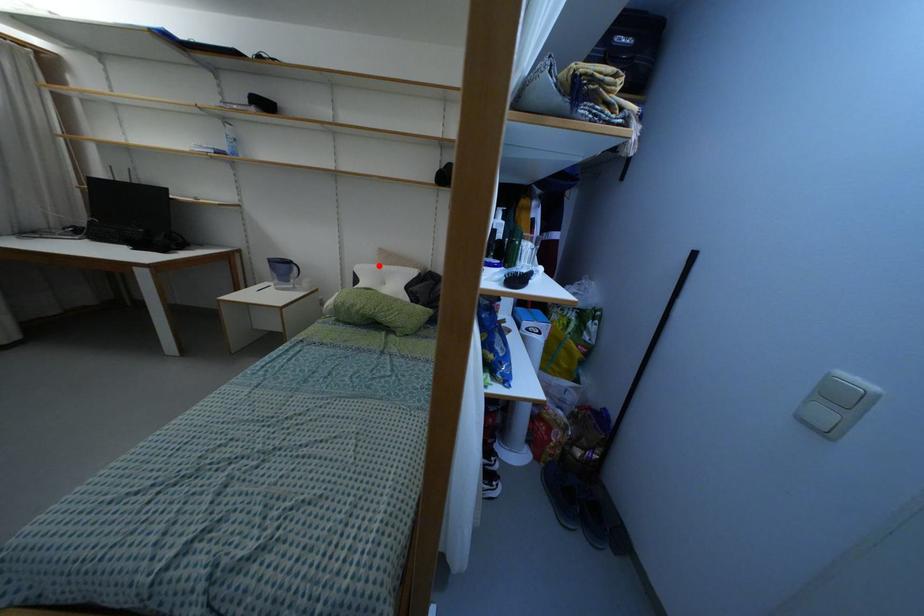
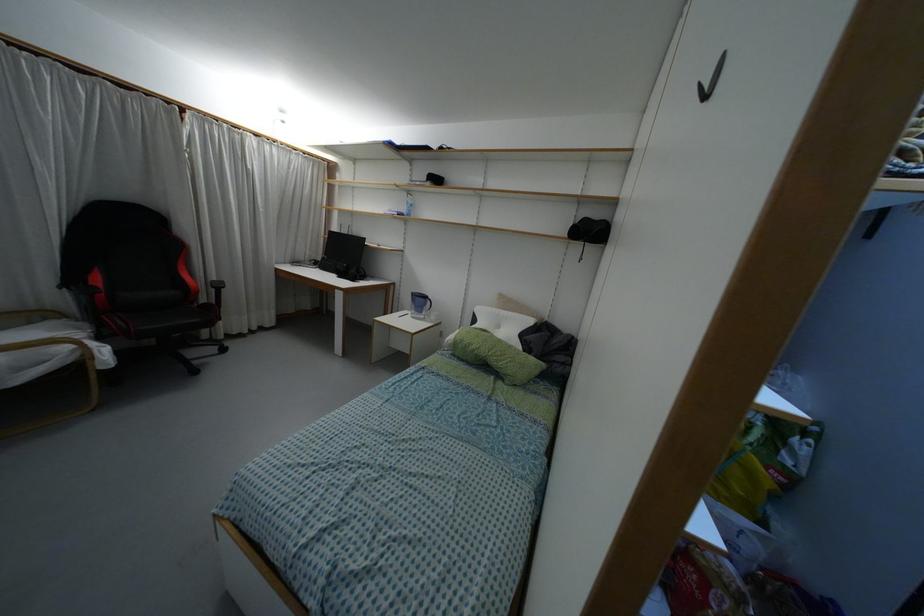
In the second image, find the point that corresponds to the highlighted location in the first image.

(496, 310)